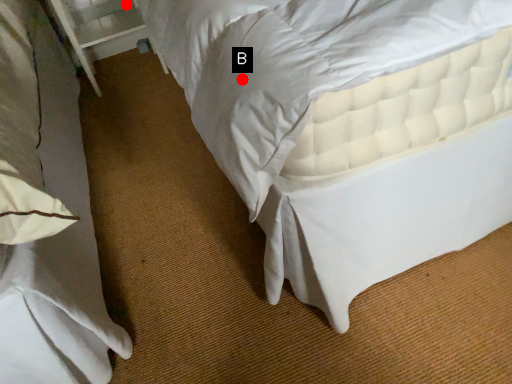
Question: Two points are circled on the image, labeled by A and B beside each circle. Which of the following is the farthest from the observer?

Choices:
 (A) A is further
 (B) B is further

Answer: (A)